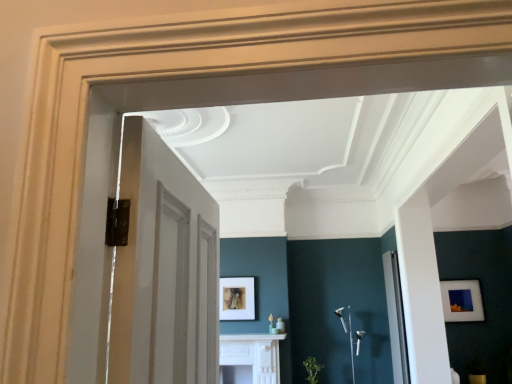
The image size is (512, 384). I want to click on matte gold picture frame at center, the first picture frame viewed from the left, so click(237, 298).

This screenshot has width=512, height=384. What do you see at coordinates (396, 318) in the screenshot?
I see `clear glass door at right` at bounding box center [396, 318].

Locate an element on the screen. clear glass door at right is located at coordinates (396, 318).

Describe the element at coordinates (312, 369) in the screenshot. The image size is (512, 384). I see `green leafy plant at lower center` at that location.

The height and width of the screenshot is (384, 512). Identify the location of matte white picture frame at right, which is the second picture frame from left to right. (462, 301).

This screenshot has width=512, height=384. In order to click on matte gold picture frame at center, the first picture frame viewed from the left in this screenshot , I will do `click(237, 298)`.

Is green leafy plant at lower center to the right of matte white picture frame at right, positioned as the first picture frame in right-to-left order, from the viewer's perspective?

In fact, green leafy plant at lower center is to the left of matte white picture frame at right, positioned as the first picture frame in right-to-left order.

Which of these two, green leafy plant at lower center or matte white picture frame at right, positioned as the first picture frame in right-to-left order, is bigger?

green leafy plant at lower center is bigger.

Does green leafy plant at lower center have a lesser width compared to matte white picture frame at right, which is the second picture frame from left to right?

No.

What's the angular difference between green leafy plant at lower center and matte white picture frame at right, positioned as the first picture frame in right-to-left order,'s facing directions?

0.151 degrees separate the facing orientations of green leafy plant at lower center and matte white picture frame at right, positioned as the first picture frame in right-to-left order.

Considering the relative sizes of matte white picture frame at right, positioned as the first picture frame in right-to-left order, and green leafy plant at lower center in the image provided, is matte white picture frame at right, positioned as the first picture frame in right-to-left order, wider than green leafy plant at lower center?

Incorrect, the width of matte white picture frame at right, positioned as the first picture frame in right-to-left order, does not surpass that of green leafy plant at lower center.

From a real-world perspective, who is located lower, matte white picture frame at right, which is the second picture frame from left to right, or green leafy plant at lower center?

In real-world perspective, green leafy plant at lower center is lower.

Image resolution: width=512 pixels, height=384 pixels. What are the coordinates of `plant in front of the matte white picture frame at right, positioned as the first picture frame in right-to-left order` in the screenshot? It's located at (312, 369).

You are a GUI agent. You are given a task and a screenshot of the screen. Output one action in this format:
    pyautogui.click(x=<x>, y=<y>)
    Task: Click on the plant behind the clear glass door at right
    
    Given the screenshot: What is the action you would take?
    pyautogui.click(x=312, y=369)

Is clear glass door at right at the back of green leafy plant at lower center?

No.

Which object is positioned more to the left, green leafy plant at lower center or clear glass door at right?

From the viewer's perspective, green leafy plant at lower center appears more on the left side.

Would you consider green leafy plant at lower center to be distant from clear glass door at right?

Yes, green leafy plant at lower center is far from clear glass door at right.

From a real-world perspective, does matte gold picture frame at center, the first picture frame viewed from the left, stand above green leafy plant at lower center?

Yes, from a real-world perspective, matte gold picture frame at center, the first picture frame viewed from the left, is over green leafy plant at lower center

Between matte gold picture frame at center, the first picture frame viewed from the left, and green leafy plant at lower center, which one has smaller size?

Smaller between the two is matte gold picture frame at center, the first picture frame viewed from the left.

Is matte gold picture frame at center, which ranks as the 2th picture frame in right-to-left order, oriented towards green leafy plant at lower center?

No, matte gold picture frame at center, which ranks as the 2th picture frame in right-to-left order, is not facing towards green leafy plant at lower center.

Which object is closer to the camera, matte white picture frame at right, which is the second picture frame from left to right, or clear glass door at right?

clear glass door at right is more forward.

From the image's perspective, is matte white picture frame at right, positioned as the first picture frame in right-to-left order, located above clear glass door at right?

Indeed, from the image's perspective, matte white picture frame at right, positioned as the first picture frame in right-to-left order, is shown above clear glass door at right.

At what (x,y) coordinates should I click in order to perform the action: click on glass door below the matte white picture frame at right, positioned as the first picture frame in right-to-left order (from the image's perspective). Please return your answer as a coordinate pair (x, y). The height and width of the screenshot is (384, 512). Looking at the image, I should click on (396, 318).

How distant is matte white picture frame at right, which is the second picture frame from left to right, from clear glass door at right?

matte white picture frame at right, which is the second picture frame from left to right, and clear glass door at right are 5.93 feet apart.

From the image's perspective, is matte white picture frame at right, which is the second picture frame from left to right, under white glossy fireplace at center?

No, from the image's perspective, matte white picture frame at right, which is the second picture frame from left to right, is not below white glossy fireplace at center.

How distant is matte white picture frame at right, positioned as the first picture frame in right-to-left order, from white glossy fireplace at center?

The distance of matte white picture frame at right, positioned as the first picture frame in right-to-left order, from white glossy fireplace at center is 8.71 feet.

Which object is closer to the camera taking this photo, matte white picture frame at right, positioned as the first picture frame in right-to-left order, or white glossy fireplace at center?

→ Positioned in front is white glossy fireplace at center.

Considering the positions of point (446, 295) and point (269, 361), is point (446, 295) closer or farther from the camera than point (269, 361)?

Point (446, 295) appears to be farther away from the viewer than point (269, 361).

Is point (231, 362) positioned behind point (393, 252)?

Yes.

Does white glossy fireplace at center lie in front of clear glass door at right?

That is False.

Would you say white glossy fireplace at center is inside or outside clear glass door at right?

The correct answer is: outside.

From a real-world perspective, who is located lower, white glossy fireplace at center or clear glass door at right?

white glossy fireplace at center.

Locate an element on the screen. picture frame to the right of green leafy plant at lower center is located at coordinates (462, 301).

This screenshot has height=384, width=512. What are the coordinates of `plant that is in front of the matte white picture frame at right, positioned as the first picture frame in right-to-left order` in the screenshot? It's located at (312, 369).

Which object lies further to the anchor point green leafy plant at lower center, matte white picture frame at right, which is the second picture frame from left to right, or clear glass door at right?

Based on the image, matte white picture frame at right, which is the second picture frame from left to right, appears to be further to green leafy plant at lower center.

Estimate the real-world distances between objects in this image. Which object is closer to matte gold picture frame at center, the first picture frame viewed from the left, white glossy fireplace at center or green leafy plant at lower center?

Based on the image, white glossy fireplace at center appears to be nearer to matte gold picture frame at center, the first picture frame viewed from the left.

When comparing their distances from matte gold picture frame at center, which ranks as the 2th picture frame in right-to-left order, does matte white picture frame at right, which is the second picture frame from left to right, or green leafy plant at lower center seem further?

Among the two, matte white picture frame at right, which is the second picture frame from left to right, is located further to matte gold picture frame at center, which ranks as the 2th picture frame in right-to-left order.

Based on their spatial positions, is clear glass door at right or matte gold picture frame at center, the first picture frame viewed from the left, closer to matte white picture frame at right, which is the second picture frame from left to right?

clear glass door at right is positioned closer to the anchor matte white picture frame at right, which is the second picture frame from left to right.

When comparing their distances from matte white picture frame at right, which is the second picture frame from left to right, does white glossy fireplace at center or clear glass door at right seem further?

white glossy fireplace at center.

When comparing their distances from white glossy fireplace at center, does green leafy plant at lower center or clear glass door at right seem closer?

The object closer to white glossy fireplace at center is green leafy plant at lower center.

From the image, which object appears to be farther from matte white picture frame at right, which is the second picture frame from left to right, white glossy fireplace at center or matte gold picture frame at center, the first picture frame viewed from the left?

Based on the image, matte gold picture frame at center, the first picture frame viewed from the left, appears to be further to matte white picture frame at right, which is the second picture frame from left to right.

Estimate the real-world distances between objects in this image. Which object is closer to clear glass door at right, white glossy fireplace at center or matte gold picture frame at center, the first picture frame viewed from the left?

white glossy fireplace at center is positioned closer to the anchor clear glass door at right.

Find the location of `plant between matte gold picture frame at center, the first picture frame viewed from the left, and matte white picture frame at right, which is the second picture frame from left to right, in the horizontal direction`. plant between matte gold picture frame at center, the first picture frame viewed from the left, and matte white picture frame at right, which is the second picture frame from left to right, in the horizontal direction is located at coordinates (312, 369).

Image resolution: width=512 pixels, height=384 pixels. I want to click on plant between white glossy fireplace at center and clear glass door at right from left to right, so click(x=312, y=369).

Where is `glass door situated between white glossy fireplace at center and matte white picture frame at right, positioned as the first picture frame in right-to-left order, from left to right`? glass door situated between white glossy fireplace at center and matte white picture frame at right, positioned as the first picture frame in right-to-left order, from left to right is located at coordinates (396, 318).

Find the location of `glass door between green leafy plant at lower center and matte white picture frame at right, positioned as the first picture frame in right-to-left order, from left to right`. glass door between green leafy plant at lower center and matte white picture frame at right, positioned as the first picture frame in right-to-left order, from left to right is located at coordinates (396, 318).